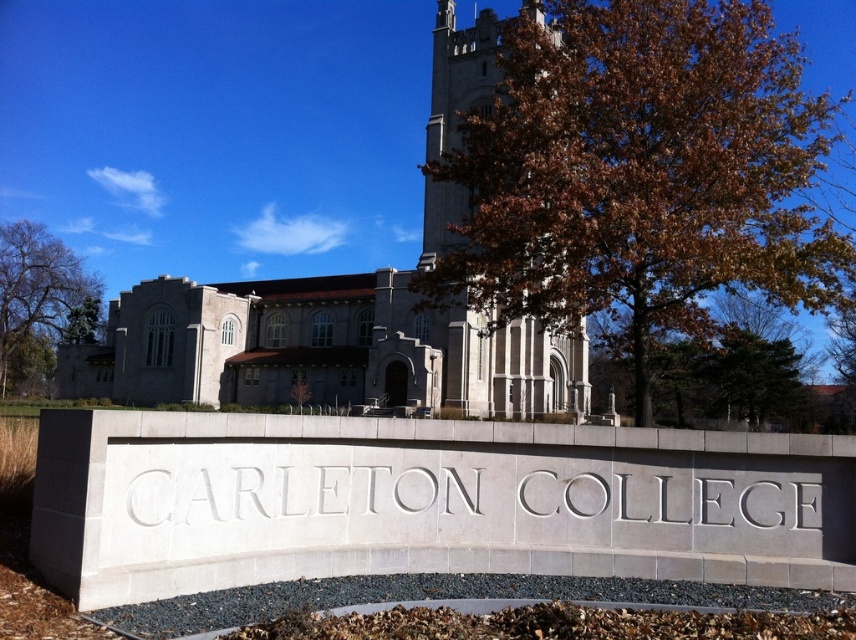
Question: Does gray stone church at center appear over brown leafy tree at left?

Choices:
 (A) yes
 (B) no

Answer: (A)

Question: Among these objects, which one is nearest to the camera?

Choices:
 (A) gray stone tower at center
 (B) brown leafy tree at left
 (C) gray stone church at center

Answer: (A)

Question: Among these objects, which one is nearest to the camera?

Choices:
 (A) brown leafy tree at upper center
 (B) gray stone church at center
 (C) brown leafy tree at left

Answer: (A)

Question: Which point is closer to the camera taking this photo?

Choices:
 (A) (470, 60)
 (B) (586, 378)

Answer: (A)

Question: Is gray stone tower at center below brown leafy tree at left?

Choices:
 (A) no
 (B) yes

Answer: (A)

Question: Is gray stone church at center smaller than gray stone tower at center?

Choices:
 (A) no
 (B) yes

Answer: (A)